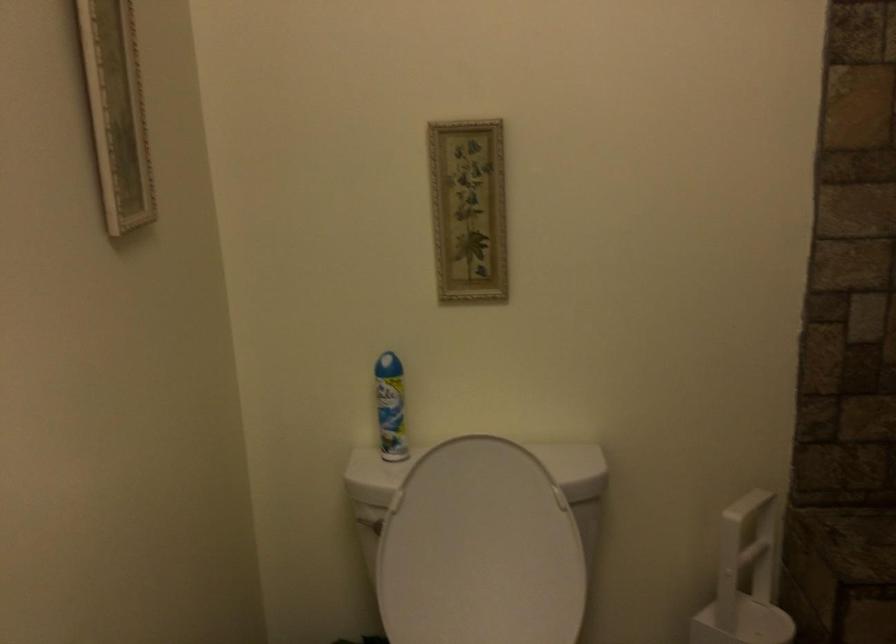
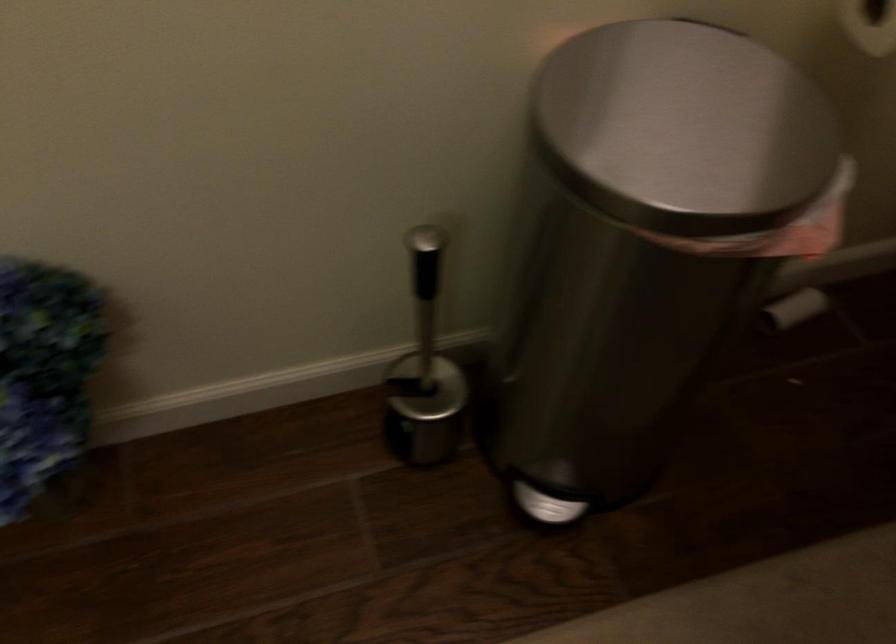
The images are taken continuously from a first-person perspective. In which direction is your viewpoint rotating?

The camera's rotation is toward left-down.